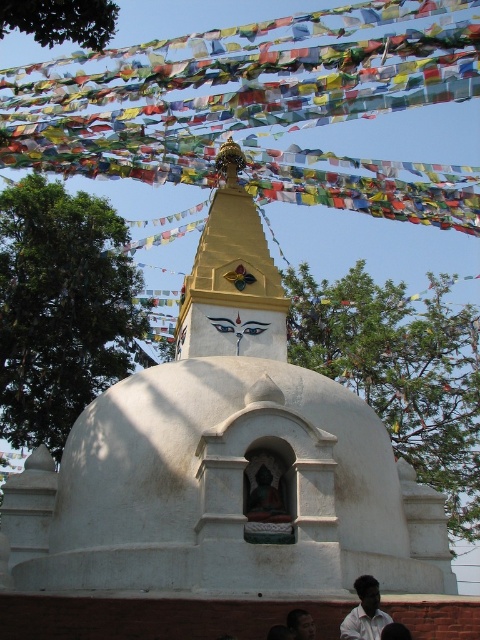
Question: Is white shirt at lower right further to the viewer compared to dark skin human face at lower center?

Choices:
 (A) yes
 (B) no

Answer: (A)

Question: Which point is closer to the camera?

Choices:
 (A) matte gold statue at center
 (B) dark skin human face at lower center
 (C) white shirt at lower right

Answer: (B)

Question: In this image, where is white shirt at lower right located relative to matte gold statue at center?

Choices:
 (A) below
 (B) above

Answer: (A)

Question: Can you confirm if white shirt at lower right is positioned below matte gold statue at center?

Choices:
 (A) no
 (B) yes

Answer: (B)

Question: Among these points, which one is farthest from the camera?

Choices:
 (A) (299, 637)
 (B) (362, 593)
 (C) (278, 506)

Answer: (C)

Question: Among these objects, which one is nearest to the camera?

Choices:
 (A) matte gold statue at center
 (B) white shirt at lower right
 (C) dark skin human face at lower center

Answer: (C)